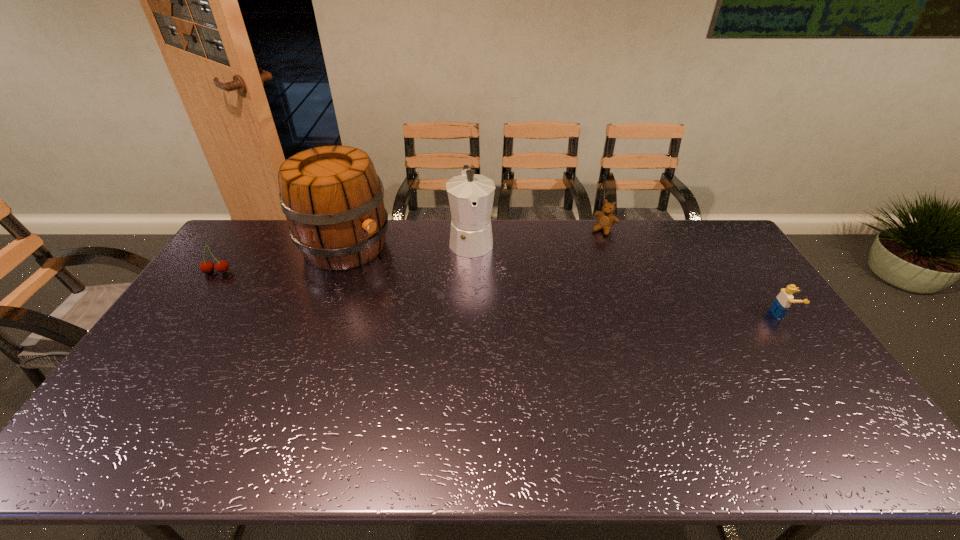
You are a GUI agent. You are given a task and a screenshot of the screen. Output one action in this format:
    pyautogui.click(x=<x>, y=<y>)
    Task: Click on the cherry
    
    Given the screenshot: What is the action you would take?
    pyautogui.click(x=221, y=266)

Locate an element on the screen. The image size is (960, 540). the rightmost object is located at coordinates (783, 301).

What are the coordinates of `the nearest object` in the screenshot? It's located at (783, 301).

Where is `the third object from right to left`? Image resolution: width=960 pixels, height=540 pixels. the third object from right to left is located at coordinates (470, 195).

Find the location of a particular element. The height and width of the screenshot is (540, 960). teddy bear is located at coordinates (606, 219).

At what (x,y) coordinates should I click in order to perform the action: click on cider. Please return your answer as a coordinate pair (x, y). Looking at the image, I should click on (332, 197).

Find the location of a particular element. The height and width of the screenshot is (540, 960). vacant space located on the surface of the cherry is located at coordinates (169, 342).

Where is `free space located 0.150m at the spout of the third object from left to right`? This screenshot has width=960, height=540. free space located 0.150m at the spout of the third object from left to right is located at coordinates (480, 293).

Image resolution: width=960 pixels, height=540 pixels. I want to click on free spot located at the spout of the third object from left to right, so click(x=479, y=288).

The height and width of the screenshot is (540, 960). Identify the location of blank space located at the spout of the third object from left to right. (479, 291).